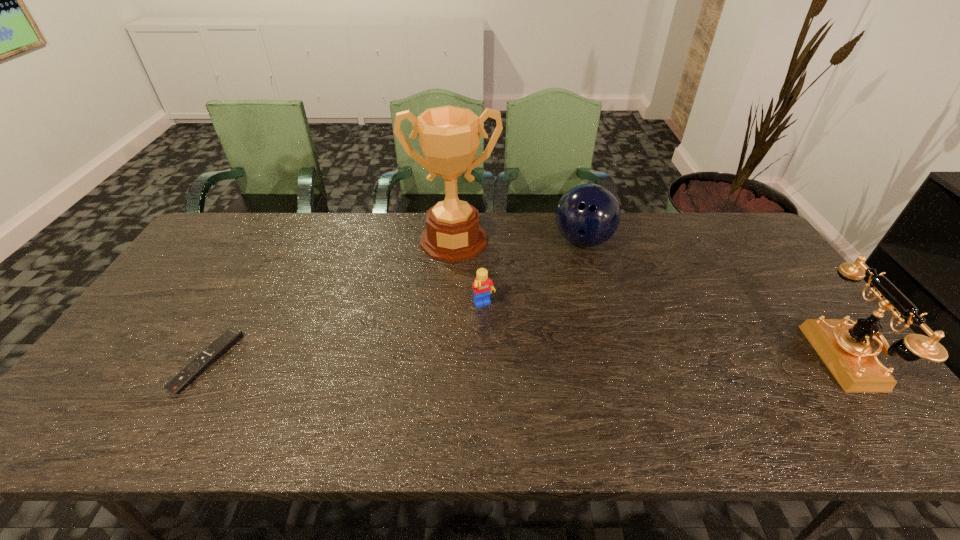
At what (x,y) coordinates should I click in order to perform the action: click on the shortest object. Please return your answer as a coordinate pair (x, y). The width and height of the screenshot is (960, 540). Looking at the image, I should click on (231, 336).

Find the location of a particular element. remote control is located at coordinates (231, 336).

Identify the location of the rightmost object. (846, 349).

The height and width of the screenshot is (540, 960). Identify the location of the tallest object. (449, 136).

This screenshot has height=540, width=960. Identify the location of the third nearest object. (482, 286).

Find the location of a particular element. the fourth tallest object is located at coordinates (482, 286).

Locate an element on the screen. This screenshot has width=960, height=540. the second object from right to left is located at coordinates (587, 215).

The width and height of the screenshot is (960, 540). Identify the location of the third tallest object. (587, 215).

Find the location of a particular element. vacant area situated on the right of the remote control is located at coordinates (367, 361).

Identify the location of free point located on the front-facing side of the award. (451, 335).